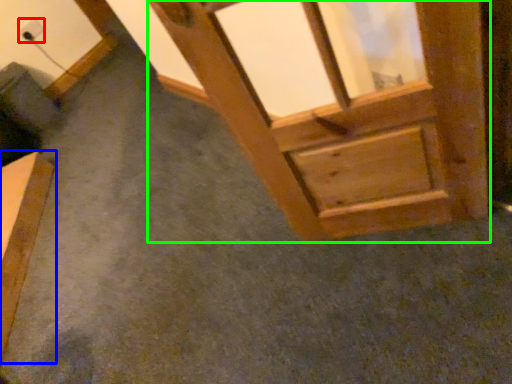
Question: Which is farther away from electric outlet (highlighted by a red box)? furniture (highlighted by a blue box) or window frame (highlighted by a green box)?

Choices:
 (A) furniture
 (B) window frame

Answer: (B)